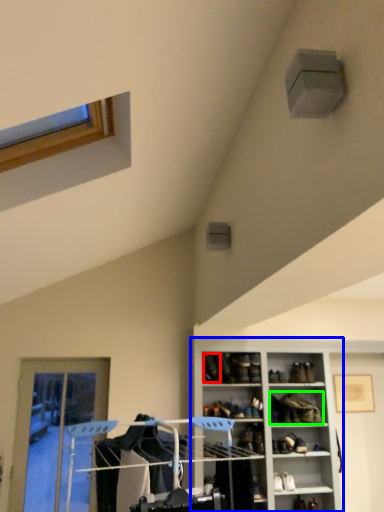
Question: Which object is positioned farthest from shoe (highlighted by a red box)? Select from cabinetry (highlighted by a blue box) and footwear (highlighted by a green box).

Choices:
 (A) cabinetry
 (B) footwear

Answer: (B)